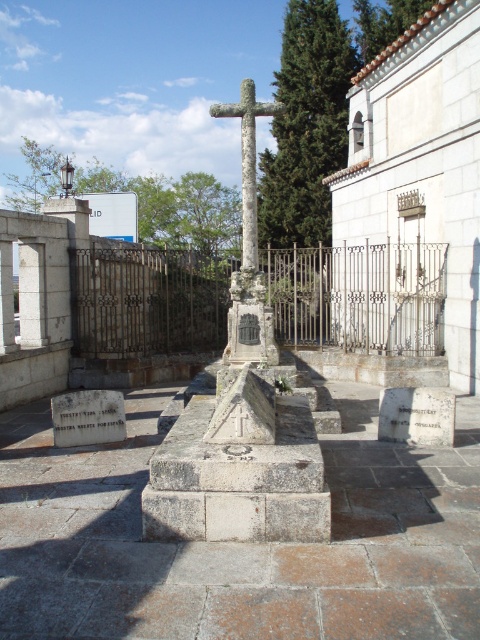
Is stone cross at center smaller than white stone gravestone at center?

Actually, stone cross at center might be larger than white stone gravestone at center.

Is point (248, 230) positioned in front of point (398, 419)?

No.

Image resolution: width=480 pixels, height=640 pixels. Identify the location of stone cross at center. (249, 241).